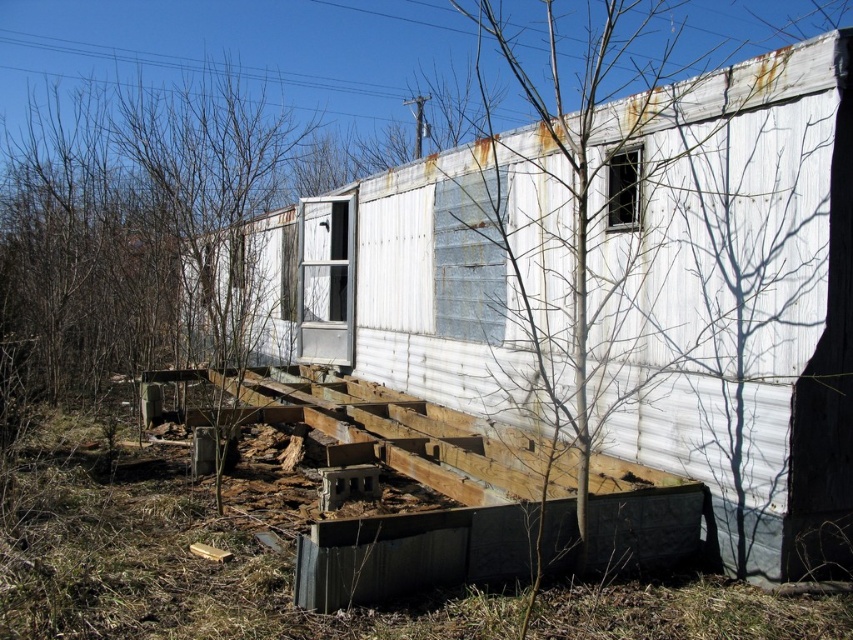
Question: Which of the following is the closest to the observer?

Choices:
 (A) (743, 509)
 (B) (569, 518)

Answer: (B)

Question: From the image, what is the correct spatial relationship of rusty corrugated metal shed at center in relation to metallic gray foundation at lower center?

Choices:
 (A) below
 (B) above

Answer: (B)

Question: Among these points, which one is farthest from the camera?

Choices:
 (A) (656, 556)
 (B) (808, 220)

Answer: (A)

Question: Is rusty corrugated metal shed at center to the right of metallic gray foundation at lower center from the viewer's perspective?

Choices:
 (A) yes
 (B) no

Answer: (B)

Question: From the image, what is the correct spatial relationship of rusty corrugated metal shed at center in relation to bare wood tree at center?

Choices:
 (A) below
 (B) above

Answer: (A)

Question: Which point appears farthest from the camera in this image?

Choices:
 (A) (666, 547)
 (B) (751, 116)
 (C) (581, 467)

Answer: (A)